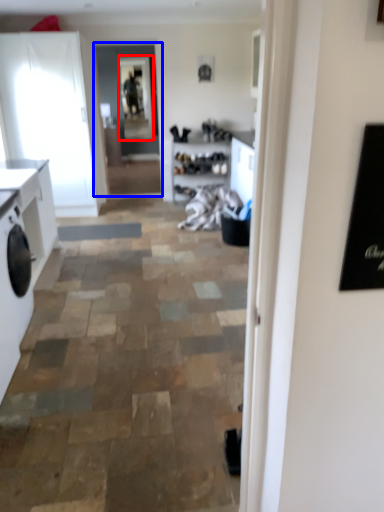
Question: Which of the following is the closest to the observer, window screen (highlighted by a red box) or glass door (highlighted by a blue box)?

Choices:
 (A) window screen
 (B) glass door

Answer: (B)